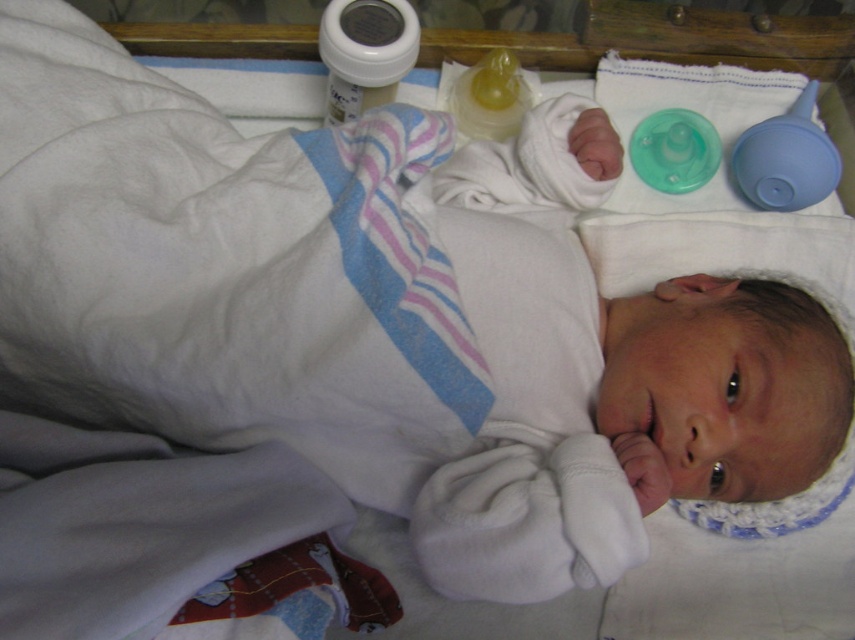
You are a nurse in a hospital nursery. You need to choose an item to hand to a new parent. The blue rubber pacifier at upper right and the translucent yellow baby bottle at upper center are both within reach. Which item is taller?

The blue rubber pacifier at upper right is much taller than the translucent yellow baby bottle at upper center.

You are a nurse standing at the edge of the bassinet. You need to reach the bottle of baby formula or milk located at point (339, 80). Can you safely reach it without disturbing the baby?

The distance between point (339, 80) and the viewer is 36.47 inches, so the nurse can safely reach the bottle of baby formula or milk located at point (339, 80) without disturbing the baby.